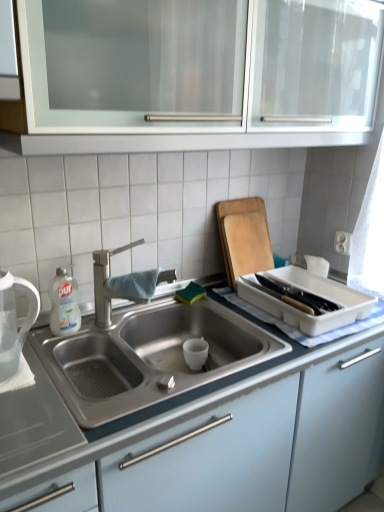
This screenshot has height=512, width=384. What do you see at coordinates (198, 74) in the screenshot?
I see `white glass cabinet at upper center, the first cabinetry positioned from the top` at bounding box center [198, 74].

Describe the element at coordinates (64, 304) in the screenshot. This screenshot has width=384, height=512. I see `white glossy bottle at left` at that location.

Describe the element at coordinates (308, 292) in the screenshot. I see `white plastic tray at right` at that location.

Describe the element at coordinates (244, 237) in the screenshot. The height and width of the screenshot is (512, 384). I see `wooden cutting board at upper right` at that location.

What is the approximate height of wooden cutting board at upper right?

wooden cutting board at upper right is 14.01 inches in height.

Identify the location of satin steel sink at center, the 1th cabinetry from the bottom. (212, 442).

At what (x,y) coordinates should I click in order to perform the action: click on the 2nd cabinetry in front of the wooden cutting board at upper right, starting your count from the anchor. Please return your answer as a coordinate pair (x, y). The width and height of the screenshot is (384, 512). Looking at the image, I should click on (198, 74).

Which is behind, white glass cabinet at upper center, the first cabinetry positioned from the top, or wooden cutting board at upper right?

wooden cutting board at upper right.

From the image's perspective, which is above, white glass cabinet at upper center, the first cabinetry positioned from the top, or wooden cutting board at upper right?

white glass cabinet at upper center, the first cabinetry positioned from the top, from the image's perspective.

Who is taller, white glass cabinet at upper center, which appears as the second cabinetry when ordered from the bottom, or wooden cutting board at upper right?

Standing taller between the two is white glass cabinet at upper center, which appears as the second cabinetry when ordered from the bottom.

Considering the relative sizes of wooden cutting board at upper right and white matte tea pot at left in the image provided, is wooden cutting board at upper right smaller than white matte tea pot at left?

No, wooden cutting board at upper right is not smaller than white matte tea pot at left.

Which of these two, wooden cutting board at upper right or white matte tea pot at left, stands taller?

wooden cutting board at upper right is taller.

From the image's perspective, is wooden cutting board at upper right beneath white matte tea pot at left?

Actually, wooden cutting board at upper right appears above white matte tea pot at left in the image.

Is wooden cutting board at upper right closer to the viewer compared to white matte tea pot at left?

No.

What's the angular difference between satin nickel faucet at center and white plastic tray at right's facing directions?

0.48 degrees.

Which point is more distant from viewer, (110, 267) or (286, 321)?

Positioned behind is point (110, 267).

From the image's perspective, is satin nickel faucet at center located above white plastic tray at right?

Correct, satin nickel faucet at center appears higher than white plastic tray at right in the image.

Is satin nickel faucet at center located outside white plastic tray at right?

Yes.

From a real-world perspective, is wooden cutting board at upper right above or below satin nickel faucet at center?

wooden cutting board at upper right is situated higher than satin nickel faucet at center in the real world.

Measure the distance from wooden cutting board at upper right to satin nickel faucet at center.

wooden cutting board at upper right is 16.90 inches from satin nickel faucet at center.

Does point (242, 204) appear closer or farther from the camera than point (147, 301)?

Clearly, point (242, 204) is more distant from the camera than point (147, 301).

Is wooden cutting board at upper right spatially inside satin nickel faucet at center, or outside of it?

wooden cutting board at upper right is not inside satin nickel faucet at center, it's outside.

Is white matte tea pot at left smaller than white glossy bottle at left?

No, white matte tea pot at left is not smaller than white glossy bottle at left.

Is white matte tea pot at left not close to white glossy bottle at left?

white matte tea pot at left is near white glossy bottle at left, not far away.

Considering the relative sizes of white matte tea pot at left and white glossy bottle at left in the image provided, is white matte tea pot at left wider than white glossy bottle at left?

Yes.

Identify the location of tea pot positioned vertically above the white glossy bottle at left (from a real-world perspective). The width and height of the screenshot is (384, 512). (14, 321).

Considering the sizes of objects satin nickel faucet at center and wooden cutting board at upper right in the image provided, who is thinner, satin nickel faucet at center or wooden cutting board at upper right?

With smaller width is wooden cutting board at upper right.

Considering the relative sizes of satin nickel faucet at center and wooden cutting board at upper right in the image provided, is satin nickel faucet at center taller than wooden cutting board at upper right?

No, satin nickel faucet at center is not taller than wooden cutting board at upper right.

Considering the sizes of objects satin nickel faucet at center and wooden cutting board at upper right in the image provided, who is bigger, satin nickel faucet at center or wooden cutting board at upper right?

Bigger between the two is satin nickel faucet at center.

Is satin nickel faucet at center inside or outside of wooden cutting board at upper right?

The correct answer is: outside.

Which of these two, wooden cutting board at upper right or white glossy bottle at left, is smaller?

white glossy bottle at left is smaller.

Is point (266, 218) in front of point (74, 317)?

No.

Is wooden cutting board at upper right spatially inside white glossy bottle at left, or outside of it?

wooden cutting board at upper right is outside white glossy bottle at left.

Measure the distance between wooden cutting board at upper right and white glossy bottle at left.

The distance of wooden cutting board at upper right from white glossy bottle at left is 26.42 inches.

In the image, there is a white glass cabinet at upper center, the first cabinetry positioned from the top. Where is `cutting board below it (from the image's perspective)`? The image size is (384, 512). cutting board below it (from the image's perspective) is located at coordinates (244, 237).

Find the location of a particular element. Image resolution: width=384 pixels, height=512 pixels. tea pot in front of the wooden cutting board at upper right is located at coordinates (14, 321).

In the scene shown: Which object lies nearer to the anchor point wooden cutting board at upper right, white glass cabinet at upper center, which appears as the second cabinetry when ordered from the bottom, or white glossy bottle at left?

white glass cabinet at upper center, which appears as the second cabinetry when ordered from the bottom.

Based on their spatial positions, is white plastic tray at right or white glossy bottle at left further from white glass cabinet at upper center, the first cabinetry positioned from the top?

white glossy bottle at left lies further to white glass cabinet at upper center, the first cabinetry positioned from the top, than the other object.

Considering their positions, is satin nickel faucet at center positioned further to satin steel sink at center, the 1th cabinetry from the bottom, than white glass cabinet at upper center, which appears as the second cabinetry when ordered from the bottom?

white glass cabinet at upper center, which appears as the second cabinetry when ordered from the bottom, lies further to satin steel sink at center, the 1th cabinetry from the bottom, than the other object.

Considering their positions, is white matte tea pot at left positioned closer to satin steel sink at center, the 1th cabinetry from the bottom, than satin nickel faucet at center?

satin nickel faucet at center.

Considering their positions, is satin nickel faucet at center positioned further to white glass cabinet at upper center, the first cabinetry positioned from the top, than satin steel sink at center, the 1th cabinetry from the bottom?

Based on the image, satin steel sink at center, the 1th cabinetry from the bottom, appears to be further to white glass cabinet at upper center, the first cabinetry positioned from the top.

Which object lies further to the anchor point satin steel sink at center, the second cabinetry in the top-to-bottom sequence, white matte tea pot at left or white glass cabinet at upper center, which appears as the second cabinetry when ordered from the bottom?

Among the two, white glass cabinet at upper center, which appears as the second cabinetry when ordered from the bottom, is located further to satin steel sink at center, the second cabinetry in the top-to-bottom sequence.

Considering their positions, is white glossy bottle at left positioned closer to satin nickel faucet at center than white matte tea pot at left?

Based on the image, white glossy bottle at left appears to be nearer to satin nickel faucet at center.

Which object lies further to the anchor point white glass cabinet at upper center, which appears as the second cabinetry when ordered from the bottom, white glossy bottle at left or wooden cutting board at upper right?

white glossy bottle at left lies further to white glass cabinet at upper center, which appears as the second cabinetry when ordered from the bottom, than the other object.

Find the location of a particular element. This screenshot has width=384, height=512. cutting board situated between satin nickel faucet at center and white plastic tray at right from left to right is located at coordinates (244, 237).

The width and height of the screenshot is (384, 512). Find the location of `cleaning product that lies between white glass cabinet at upper center, which appears as the second cabinetry when ordered from the bottom, and white matte tea pot at left from top to bottom`. cleaning product that lies between white glass cabinet at upper center, which appears as the second cabinetry when ordered from the bottom, and white matte tea pot at left from top to bottom is located at coordinates (64, 304).

Locate an element on the screen. The height and width of the screenshot is (512, 384). cleaning product located between satin steel sink at center, the second cabinetry in the top-to-bottom sequence, and wooden cutting board at upper right in the depth direction is located at coordinates (64, 304).

This screenshot has height=512, width=384. I want to click on tap positioned between white matte tea pot at left and white glossy bottle at left from near to far, so click(107, 285).